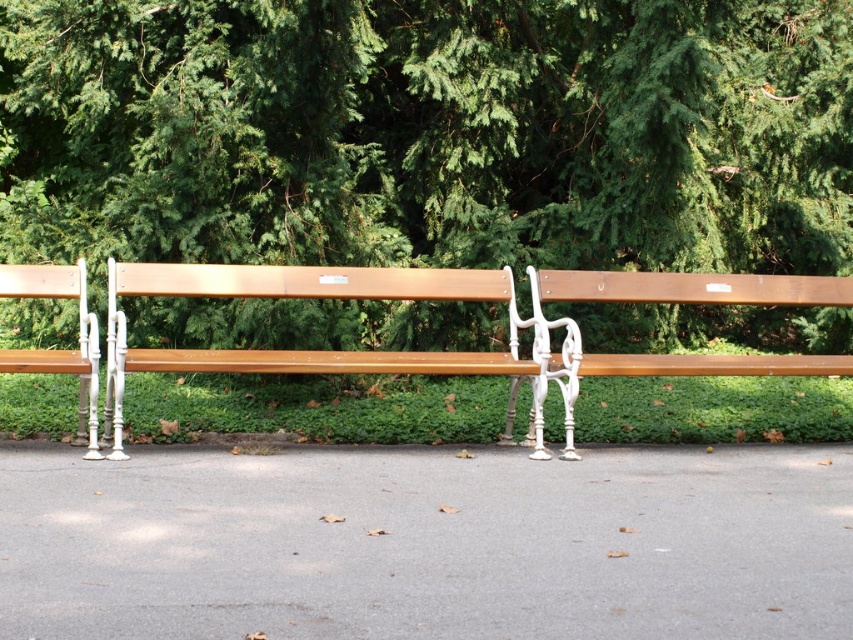
Does point (189, 275) come farther from viewer compared to point (691, 368)?

Yes, point (189, 275) is farther from viewer.

Does wooden bench at center have a lesser height compared to matte wood bench at right?

Incorrect, wooden bench at center's height does not fall short of matte wood bench at right's.

Which is in front, point (241, 276) or point (779, 365)?

Point (779, 365)

Where is `wooden bench at center`? The width and height of the screenshot is (853, 640). wooden bench at center is located at coordinates (294, 298).

In the scene shown: Which is more to the right, green leafy tree at upper center or wooden bench at center?

wooden bench at center is more to the right.

Does point (277, 324) come in front of point (387, 291)?

That is False.

Who is more distant from viewer, (613, 244) or (108, 403)?

Point (613, 244)

The height and width of the screenshot is (640, 853). What are the coordinates of `green leafy tree at upper center` in the screenshot? It's located at (430, 132).

Can you confirm if green leafy tree at upper center is positioned to the left of matte wood bench at right?

Correct, you'll find green leafy tree at upper center to the left of matte wood bench at right.

Is green leafy tree at upper center in front of matte wood bench at right?

No.

Which is in front, point (306, 332) or point (671, 284)?

Positioned in front is point (671, 284).

Where is `green leafy tree at upper center`? This screenshot has height=640, width=853. green leafy tree at upper center is located at coordinates (430, 132).